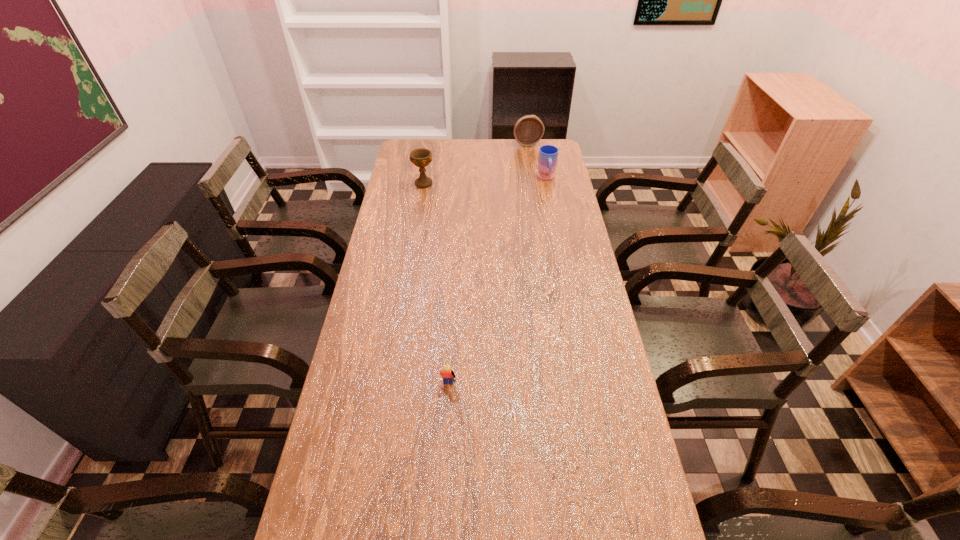
Locate an element on the screen. The image size is (960, 540). object that is at the left edge is located at coordinates (421, 157).

Identify the location of bowl that is positioned at the right edge. Image resolution: width=960 pixels, height=540 pixels. (528, 130).

This screenshot has width=960, height=540. Identify the location of mug that is at the right edge. (548, 154).

Locate an element on the screen. The height and width of the screenshot is (540, 960). object that is at the far right corner is located at coordinates (528, 130).

In the image, there is a desktop. Identify the location of vacant space at the far edge. (516, 143).

At what (x,y) coordinates should I click in order to perform the action: click on vacant space at the left edge of the desktop. Please return your answer as a coordinate pair (x, y). Looking at the image, I should click on (382, 485).

At what (x,y) coordinates should I click in order to perform the action: click on free location at the right edge. Please return your answer as a coordinate pair (x, y). The height and width of the screenshot is (540, 960). Looking at the image, I should click on (541, 197).

Find the location of `free space between the third object from right to left and the bowl`. free space between the third object from right to left and the bowl is located at coordinates (488, 266).

This screenshot has width=960, height=540. I want to click on empty space between the leftmost object and the mug, so click(x=485, y=180).

Locate an element on the screen. The height and width of the screenshot is (540, 960). free space between the mug and the shortest object is located at coordinates (497, 283).